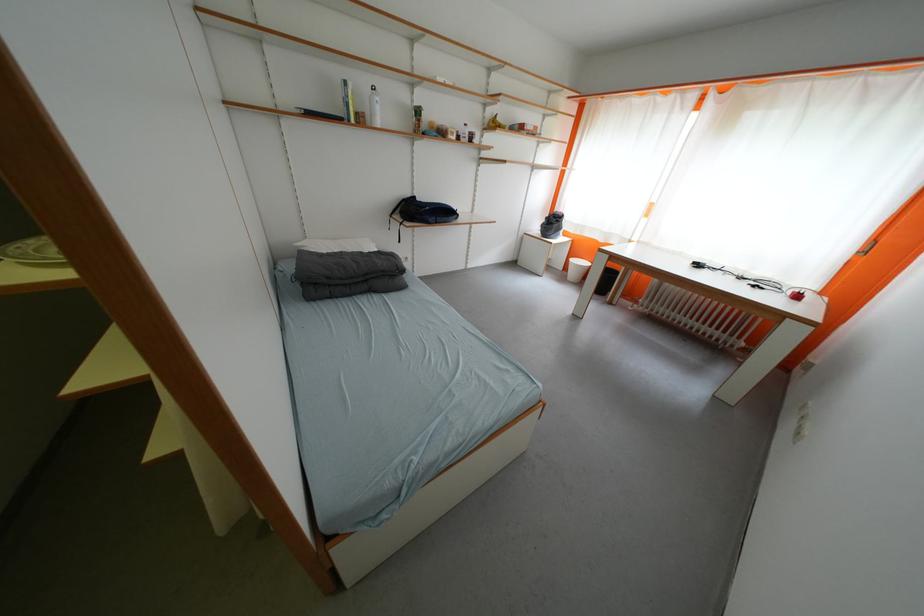
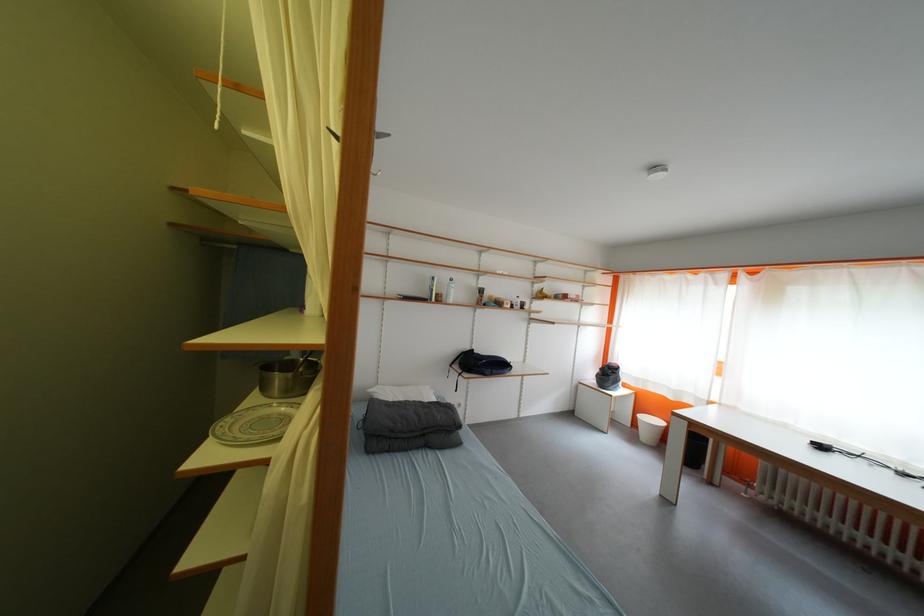
Locate, in the second image, the point that corresponds to point 371,124 in the first image.

(447, 302)